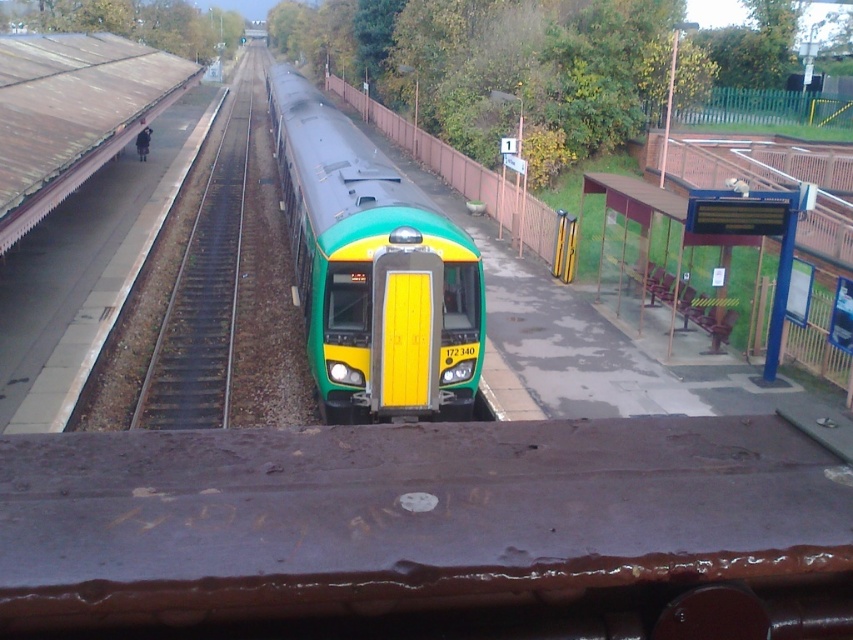
You are a maintenance worker needing to move a 3.5 meter wide equipment cart across the platform. The cart must stay entirely within the green matte train at center and the brown gravel train track at left. Can the cart fit between them without crossing either?

The green matte train at center is narrower than the brown gravel train track at left. Since the cart is 3.5 meters wide, it might not fit between them if the space between the train and track is narrower than 3.5 meters. However, the exact distance isn not provided in the description.

You are a train conductor who needs to ensure the green matte train at center can fully fit on the brown gravel train track at left. Based on the scene, can you confirm if the train will fit without any part hanging off the track?

The green matte train at center is shorter than the brown gravel train track at left, so it will fit fully without any part hanging off the track.